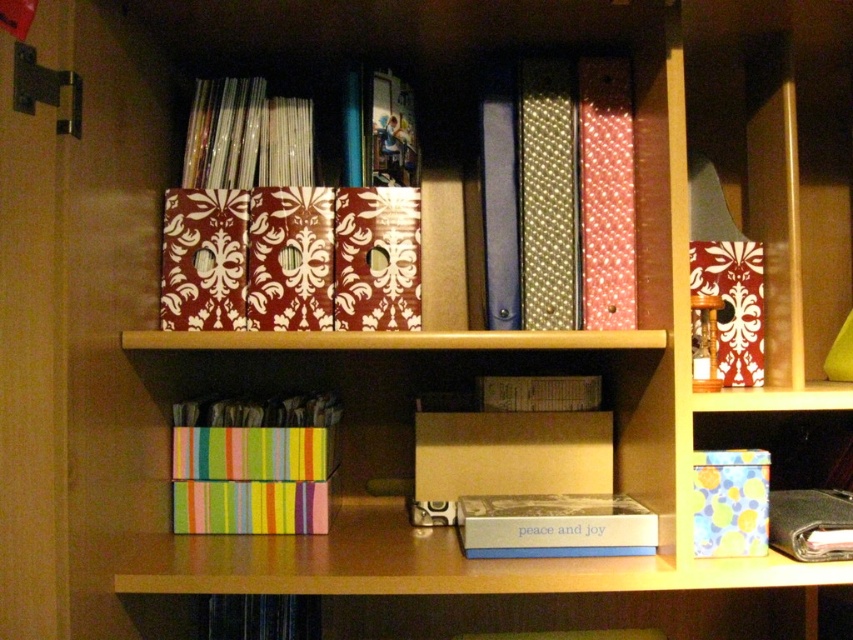
Question: Can you confirm if blue matte book at center is positioned above matte cardboard book at center?

Choices:
 (A) yes
 (B) no

Answer: (B)

Question: Observing the image, what is the correct spatial positioning of polka dot fabric tie at center in reference to yellow polka dot box at center?

Choices:
 (A) below
 (B) above

Answer: (B)

Question: Which object appears farthest from the camera in this image?

Choices:
 (A) matte cardboard book at center
 (B) yellow polka dot box at center
 (C) blue matte book at center

Answer: (A)

Question: Which point appears farthest from the camera in this image?

Choices:
 (A) (554, 492)
 (B) (566, 189)
 (C) (517, 556)
 (D) (746, 452)

Answer: (A)

Question: Among these points, which one is nearest to the camera?

Choices:
 (A) (590, 122)
 (B) (740, 308)
 (C) (701, 522)
 (D) (556, 236)

Answer: (C)

Question: Is matte white box at center positioned in front of blue matte book at center?

Choices:
 (A) no
 (B) yes

Answer: (A)